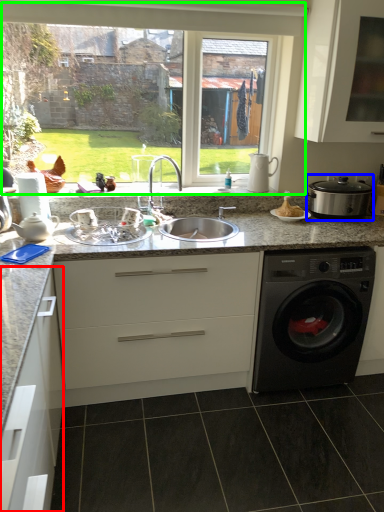
Question: Considering the real-world distances, which object is closest to cabinetry (highlighted by a red box)? appliance (highlighted by a blue box) or window (highlighted by a green box).

Choices:
 (A) appliance
 (B) window

Answer: (B)